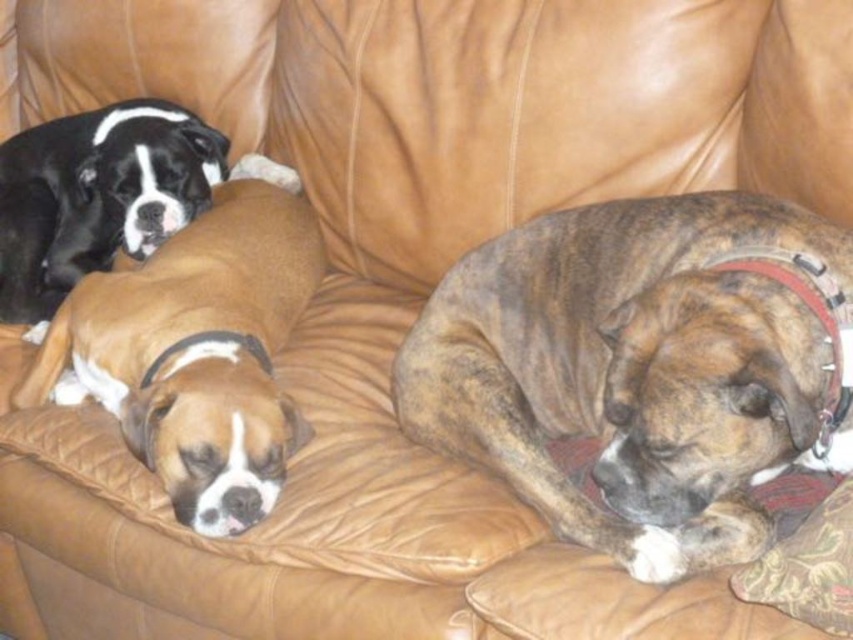
You are a photographer trying to capture a closeup of the brown leather dog at center. Given that the camera focus point is currently at coordinates 0.5, 0.2, should you adjust the focus point to the right or left to better capture the dog?

The brown leather dog at center is located at point (196, 348). Since the current focus point is at (170, 320), you should adjust the focus point slightly to the right to better capture the dog.

You are a dog owner who wants to place a new dog bed on the couch. The bed requires 1.2 meters of space. Based on the height difference between the brown brindle dog at center and the black glossy dog at upper left, can you determine if the bed will fit between them?

The brown brindle dog at center is taller than the black glossy dog at upper left, but the question is about space between them. The height difference doesn not directly indicate the available space between them. You need to measure the distance between them to determine if the bed will fit.